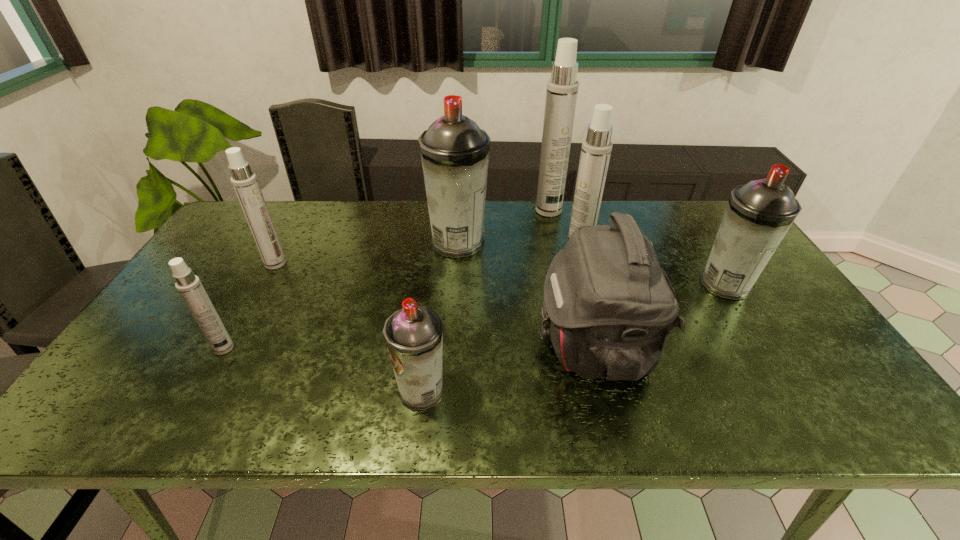
Find the location of `the farthest object`. the farthest object is located at coordinates (562, 89).

This screenshot has width=960, height=540. I want to click on the biggest white aerosol can, so click(x=562, y=89).

Where is `the biggest gray aerosol can`? This screenshot has height=540, width=960. the biggest gray aerosol can is located at coordinates (454, 151).

Identify the location of the second biggest white aerosol can. The height and width of the screenshot is (540, 960). (596, 149).

In order to click on the rightmost object in this screenshot , I will do `click(758, 215)`.

Where is `the second nearest gray aerosol can`? The image size is (960, 540). the second nearest gray aerosol can is located at coordinates point(758,215).

Where is `the third biggest white aerosol can`? The width and height of the screenshot is (960, 540). the third biggest white aerosol can is located at coordinates (244, 181).

Where is `gray shoulder bag`? The width and height of the screenshot is (960, 540). gray shoulder bag is located at coordinates point(609,308).

In order to click on the smallest white aerosol can in this screenshot , I will do `click(189, 286)`.

Identify the location of the second nearest aerosol can. [x=189, y=286].